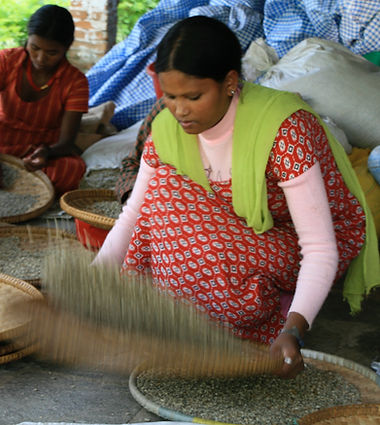
The width and height of the screenshot is (380, 425). In order to click on basket in this screenshot , I will do `click(145, 402)`, `click(11, 331)`, `click(15, 341)`, `click(13, 355)`, `click(341, 410)`, `click(34, 207)`, `click(38, 229)`, `click(66, 205)`.